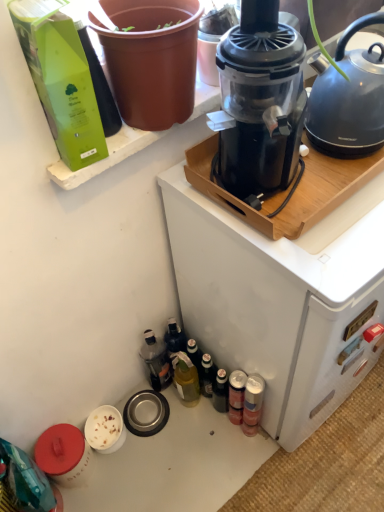
Identify the location of free space in front of black plastic coffee maker at upper center. This screenshot has height=512, width=384. (293, 463).